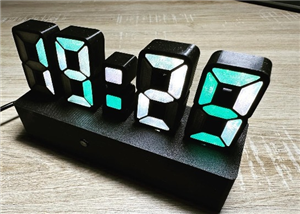
Find the location of a particular element. digital clock is located at coordinates (160, 121).